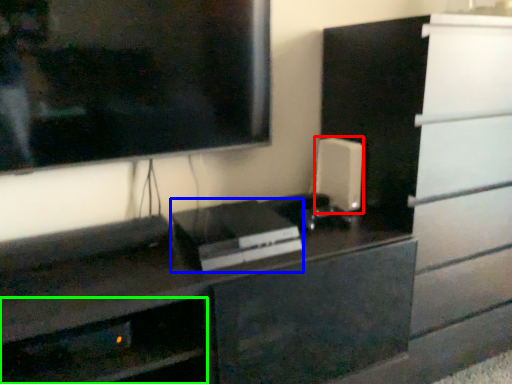
Question: Estimate the real-world distances between objects in this image. Which object is farther from appliance (highlighted by a red box), appliance (highlighted by a blue box) or shelf (highlighted by a green box)?

Choices:
 (A) appliance
 (B) shelf

Answer: (B)